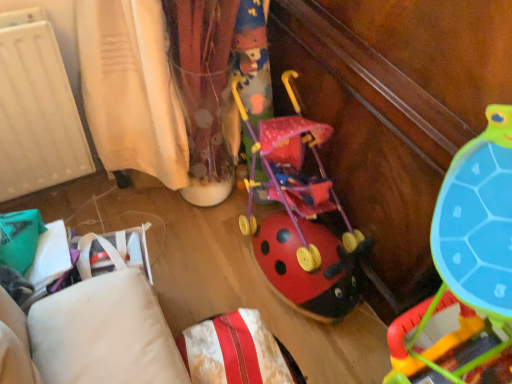
You are a GUI agent. You are given a task and a screenshot of the screen. Output one action in this format:
    pyautogui.click(x=<x>, y=<y>)
    Task: Click on the matte plastic stroller at center, the second toy in the bottom-to-top sequence
    This screenshot has width=512, height=384.
    Given the screenshot: What is the action you would take?
    pyautogui.click(x=300, y=216)

Find the location of a particular element. The image size is (512, 384). pillow behind the rubberized plastic ladybug stroller at center, the 2th toy viewed from the top is located at coordinates (234, 351).

Are rubberized plastic ladybug stroller at center, the 2th toy viewed from the top, and velvety white pillow at lower center far apart?

rubberized plastic ladybug stroller at center, the 2th toy viewed from the top, is actually quite close to velvety white pillow at lower center.

Considering the sizes of rubberized plastic ladybug stroller at center, the 2th toy viewed from the top, and velvety white pillow at lower center in the image, is rubberized plastic ladybug stroller at center, the 2th toy viewed from the top, bigger or smaller than velvety white pillow at lower center?

In the image, rubberized plastic ladybug stroller at center, the 2th toy viewed from the top, appears to be larger than velvety white pillow at lower center.

Locate an element on the screen. The image size is (512, 384). toy on the left of rubberized plastic ladybug stroller at center, the 2th toy viewed from the top is located at coordinates (300, 216).

Looking at their sizes, would you say rubberized plastic ladybug stroller at center, arranged as the first toy when ordered from the bottom, is wider or thinner than matte plastic stroller at center, the 1th toy in the top-to-bottom sequence?

rubberized plastic ladybug stroller at center, arranged as the first toy when ordered from the bottom, is wider than matte plastic stroller at center, the 1th toy in the top-to-bottom sequence.

From a real-world perspective, which is physically above, rubberized plastic ladybug stroller at center, the 2th toy viewed from the top, or matte plastic stroller at center, the 1th toy in the top-to-bottom sequence?

rubberized plastic ladybug stroller at center, the 2th toy viewed from the top, is physically above.

In the scene shown: From the image's perspective, is rubberized plastic ladybug stroller at center, the 2th toy viewed from the top, on matte plastic stroller at center, the second toy in the bottom-to-top sequence?

No.

What's the angular difference between velvety white pillow at lower center and rubberized plastic ladybug stroller at center, the 2th toy viewed from the top,'s facing directions?

The angular difference between velvety white pillow at lower center and rubberized plastic ladybug stroller at center, the 2th toy viewed from the top, is 90.3 degrees.

Identify the location of toy that is in front of the velvety white pillow at lower center. (467, 269).

Is velvety white pillow at lower center bigger or smaller than rubberized plastic ladybug stroller at center, the 2th toy viewed from the top?

velvety white pillow at lower center is smaller than rubberized plastic ladybug stroller at center, the 2th toy viewed from the top.

Could you measure the distance between velvety white pillow at lower center and rubberized plastic ladybug stroller at center, arranged as the first toy when ordered from the bottom?

They are 16.29 inches apart.

Considering the relative sizes of matte plastic stroller at center, the second toy in the bottom-to-top sequence, and velvety white pillow at lower center in the image provided, is matte plastic stroller at center, the second toy in the bottom-to-top sequence, thinner than velvety white pillow at lower center?

In fact, matte plastic stroller at center, the second toy in the bottom-to-top sequence, might be wider than velvety white pillow at lower center.

Is matte plastic stroller at center, the 1th toy in the top-to-bottom sequence, next to velvety white pillow at lower center?

matte plastic stroller at center, the 1th toy in the top-to-bottom sequence, and velvety white pillow at lower center are not in contact.

Does matte plastic stroller at center, the second toy in the bottom-to-top sequence, have a lesser height compared to velvety white pillow at lower center?

No, matte plastic stroller at center, the second toy in the bottom-to-top sequence, is not shorter than velvety white pillow at lower center.

Considering the sizes of objects velvety white pillow at lower center and matte plastic stroller at center, the second toy in the bottom-to-top sequence, in the image provided, who is smaller, velvety white pillow at lower center or matte plastic stroller at center, the second toy in the bottom-to-top sequence,?

velvety white pillow at lower center.

Considering the relative sizes of velvety white pillow at lower center and matte plastic stroller at center, the second toy in the bottom-to-top sequence, in the image provided, is velvety white pillow at lower center wider than matte plastic stroller at center, the second toy in the bottom-to-top sequence,?

Incorrect, the width of velvety white pillow at lower center does not surpass that of matte plastic stroller at center, the second toy in the bottom-to-top sequence.

Is point (293, 377) more distant than point (313, 302)?

That is False.

From a real-world perspective, relative to matte plastic stroller at center, the 1th toy in the top-to-bottom sequence, is velvety white pillow at lower center vertically above or below?

Clearly, from a real-world perspective, velvety white pillow at lower center is below matte plastic stroller at center, the 1th toy in the top-to-bottom sequence.

From the picture: Is matte plastic stroller at center, the second toy in the bottom-to-top sequence, facing towards rubberized plastic ladybug stroller at center, the 2th toy viewed from the top?

No, matte plastic stroller at center, the second toy in the bottom-to-top sequence, is not aimed at rubberized plastic ladybug stroller at center, the 2th toy viewed from the top.

Considering the sizes of objects matte plastic stroller at center, the second toy in the bottom-to-top sequence, and rubberized plastic ladybug stroller at center, arranged as the first toy when ordered from the bottom, in the image provided, who is bigger, matte plastic stroller at center, the second toy in the bottom-to-top sequence, or rubberized plastic ladybug stroller at center, arranged as the first toy when ordered from the bottom,?

rubberized plastic ladybug stroller at center, arranged as the first toy when ordered from the bottom, is bigger.

In terms of width, does matte plastic stroller at center, the second toy in the bottom-to-top sequence, look wider or thinner when compared to rubberized plastic ladybug stroller at center, arranged as the first toy when ordered from the bottom?

Clearly, matte plastic stroller at center, the second toy in the bottom-to-top sequence, has less width compared to rubberized plastic ladybug stroller at center, arranged as the first toy when ordered from the bottom.

Is matte plastic stroller at center, the 1th toy in the top-to-bottom sequence, surrounding rubberized plastic ladybug stroller at center, the 2th toy viewed from the top?

No, rubberized plastic ladybug stroller at center, the 2th toy viewed from the top, is not surrounded by matte plastic stroller at center, the 1th toy in the top-to-bottom sequence.

Locate an element on the screen. The height and width of the screenshot is (384, 512). pillow below the rubberized plastic ladybug stroller at center, arranged as the first toy when ordered from the bottom (from a real-world perspective) is located at coordinates (234, 351).

Identify the location of toy on the right of matte plastic stroller at center, the second toy in the bottom-to-top sequence. Image resolution: width=512 pixels, height=384 pixels. click(x=467, y=269).

Estimate the real-world distances between objects in this image. Which object is further from velvety white pillow at lower center, rubberized plastic ladybug stroller at center, the 2th toy viewed from the top, or matte plastic stroller at center, the 1th toy in the top-to-bottom sequence?

matte plastic stroller at center, the 1th toy in the top-to-bottom sequence, is further to velvety white pillow at lower center.

Which object lies further to the anchor point rubberized plastic ladybug stroller at center, the 2th toy viewed from the top, matte plastic stroller at center, the second toy in the bottom-to-top sequence, or velvety white pillow at lower center?

The object further to rubberized plastic ladybug stroller at center, the 2th toy viewed from the top, is matte plastic stroller at center, the second toy in the bottom-to-top sequence.

Which object lies further to the anchor point matte plastic stroller at center, the second toy in the bottom-to-top sequence, velvety white pillow at lower center or rubberized plastic ladybug stroller at center, arranged as the first toy when ordered from the bottom?

Based on the image, velvety white pillow at lower center appears to be further to matte plastic stroller at center, the second toy in the bottom-to-top sequence.

Considering their positions, is matte plastic stroller at center, the second toy in the bottom-to-top sequence, positioned further to velvety white pillow at lower center than rubberized plastic ladybug stroller at center, arranged as the first toy when ordered from the bottom?

matte plastic stroller at center, the second toy in the bottom-to-top sequence.

Estimate the real-world distances between objects in this image. Which object is further from matte plastic stroller at center, the second toy in the bottom-to-top sequence, rubberized plastic ladybug stroller at center, arranged as the first toy when ordered from the bottom, or velvety white pillow at lower center?

Result: Among the two, velvety white pillow at lower center is located further to matte plastic stroller at center, the second toy in the bottom-to-top sequence.

When comparing their distances from rubberized plastic ladybug stroller at center, the 2th toy viewed from the top, does velvety white pillow at lower center or matte plastic stroller at center, the 1th toy in the top-to-bottom sequence, seem further?

Among the two, matte plastic stroller at center, the 1th toy in the top-to-bottom sequence, is located further to rubberized plastic ladybug stroller at center, the 2th toy viewed from the top.

This screenshot has width=512, height=384. I want to click on toy that lies between matte plastic stroller at center, the second toy in the bottom-to-top sequence, and velvety white pillow at lower center from top to bottom, so click(x=467, y=269).